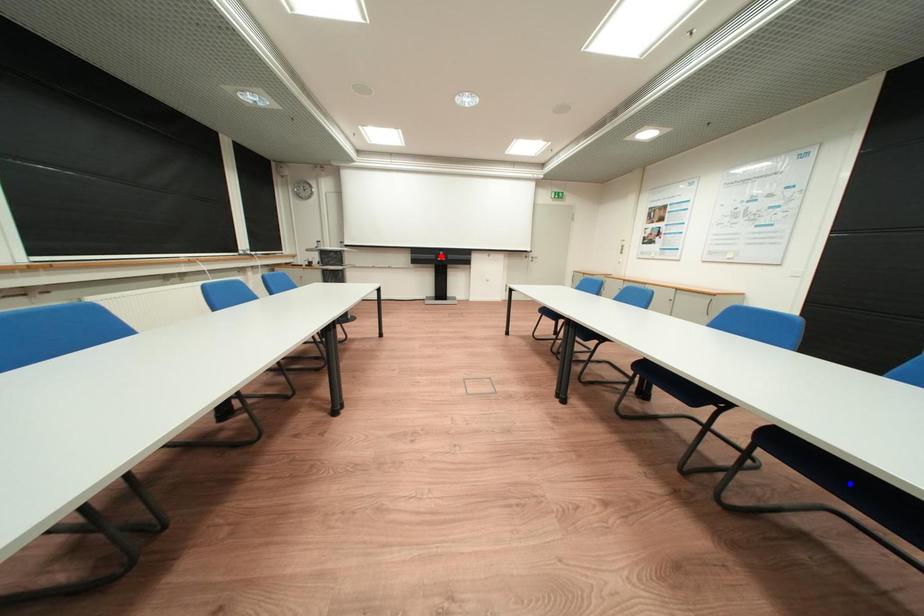
Question: In the image, two points are highlighted. Which point is nearer to the camera? Reply with the corresponding letter.

Choices:
 (A) blue point
 (B) red point

Answer: (A)